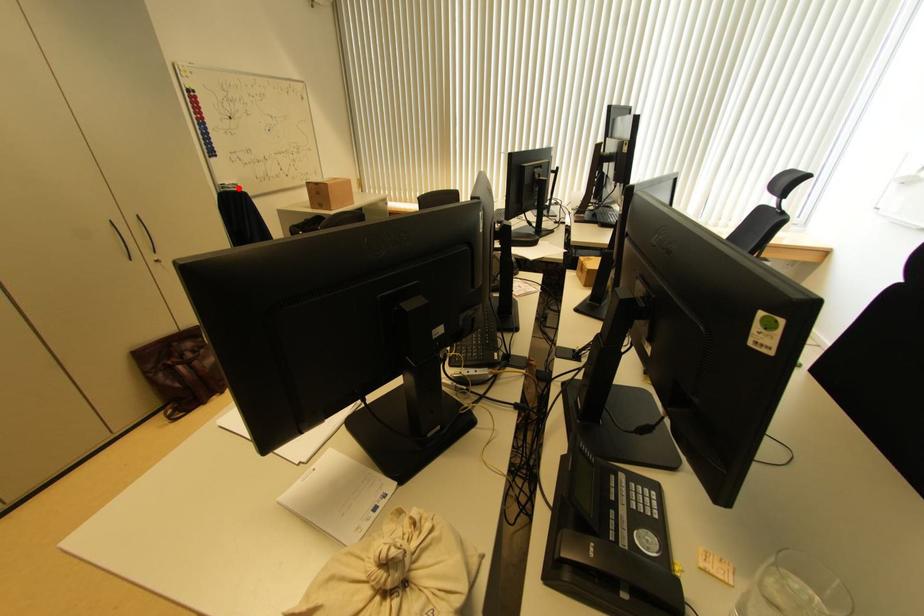
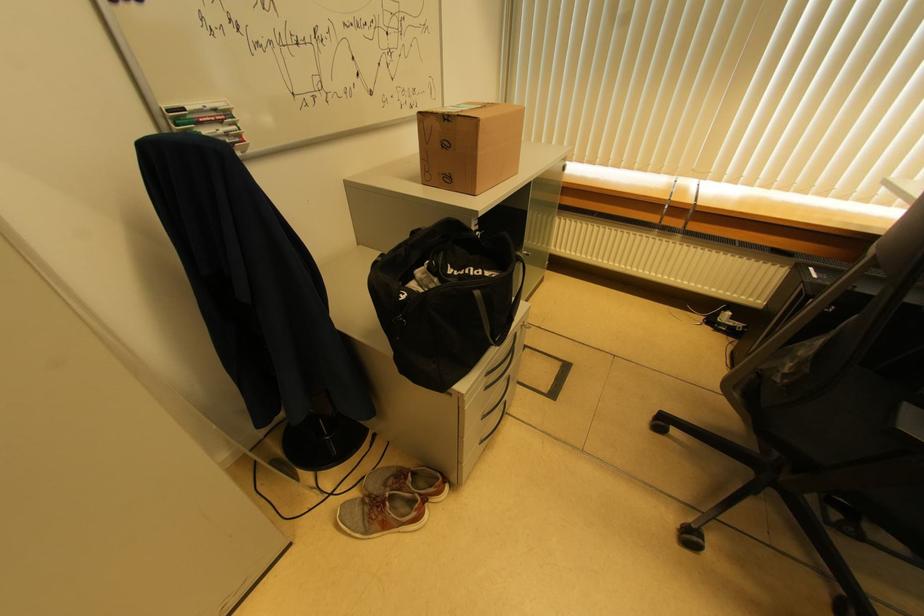
Find the pixel in the second image that matches the highlighted location in the first image.

(229, 116)